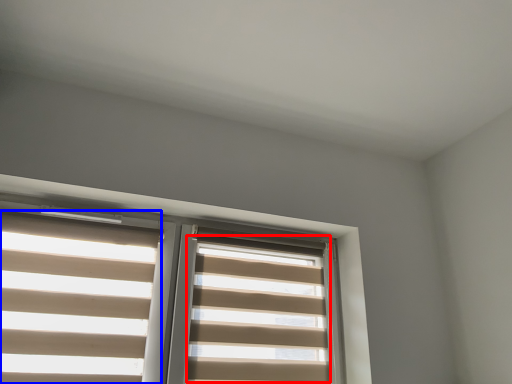
Question: Which point is closer to the camera, blind (highlighted by a red box) or blind (highlighted by a blue box)?

Choices:
 (A) blind
 (B) blind

Answer: (B)